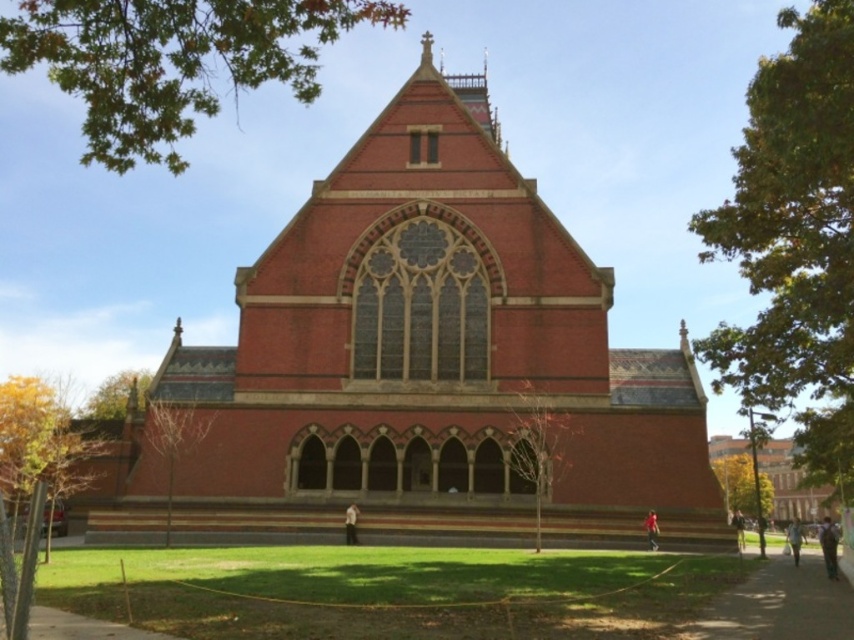
Is green leafy tree at upper right shorter than green leafy tree at lower left?

Incorrect, green leafy tree at upper right's height does not fall short of green leafy tree at lower left's.

Between green leafy tree at upper right and green leafy tree at lower left, which one has less height?

With less height is green leafy tree at lower left.

Between point (738, 344) and point (143, 396), which one is positioned in front?

Point (738, 344) is in front.

The height and width of the screenshot is (640, 854). What are the coordinates of `green leafy tree at upper right` in the screenshot? It's located at (794, 241).

Does red brick church at center appear over green leafy tree at upper right?

No, red brick church at center is not above green leafy tree at upper right.

Which is more to the left, red brick church at center or green leafy tree at upper right?

red brick church at center is more to the left.

Between point (488, 248) and point (788, 188), which one is positioned behind?

The point (488, 248) is behind.

I want to click on red brick church at center, so click(433, 356).

Is yellow-green leaves at lower left thinner than bare branches at lower left?

No.

Which of these two, yellow-green leaves at lower left or bare branches at lower left, stands shorter?

bare branches at lower left is shorter.

Does point (33, 515) come farther from viewer compared to point (184, 436)?

No, it is not.

Identify the location of yellow-green leaves at lower left. (31, 480).